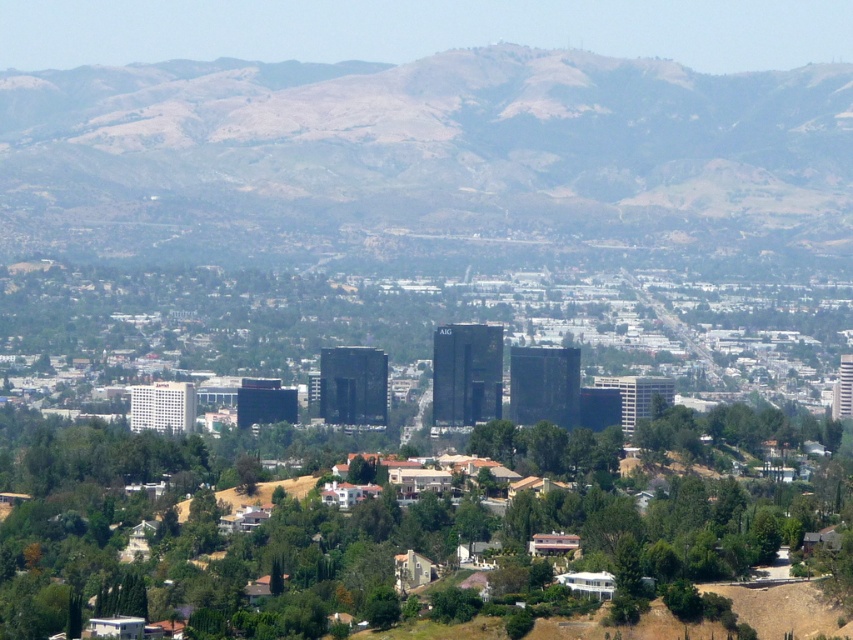
You are standing at the camera position looking at the cityscape. A drone is flying towards the point marked at coordinates point [593,163]. If the drone is currently 100 meters away from you, how much further does it need to travel to reach the point?

The point [593,163] is 659.52 meters away from the camera. Since the drone is currently 100 meters away, it needs to travel an additional 659.52 minus 100 equals 559.52 meters to reach the point.